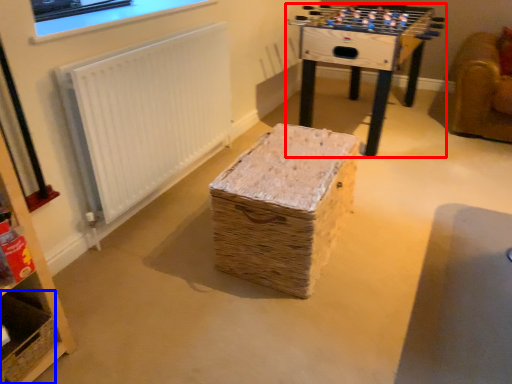
Question: Which object is closer to the camera taking this photo, table (highlighted by a red box) or basket (highlighted by a blue box)?

Choices:
 (A) table
 (B) basket

Answer: (B)